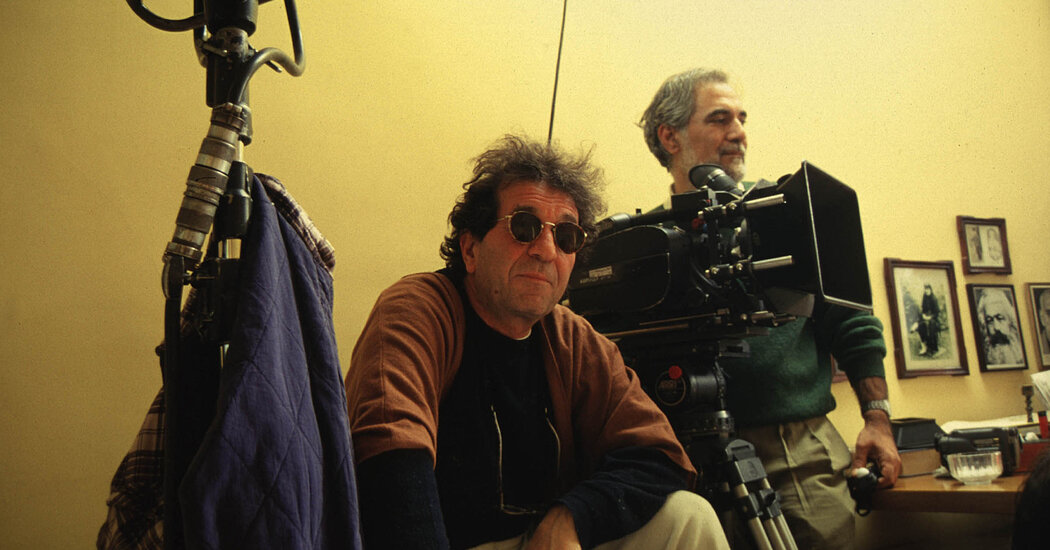
Identify the location of desktop is partially visible. (966, 486), (1003, 505).